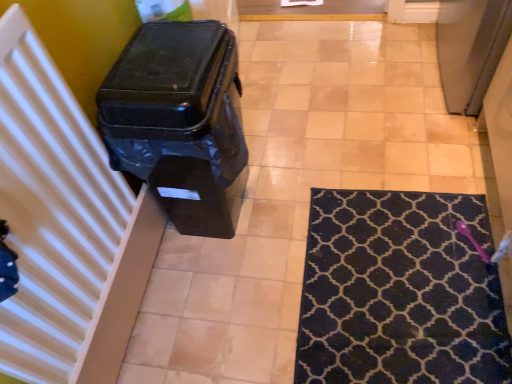
In order to face black plastic waste container at left, should I rotate leftwards or rightwards?

Turn left approximately 7.880 degrees to face it.

The image size is (512, 384). Identify the location of navy blue textured rug at lower right. (400, 292).

Locate an element on the screen. This screenshot has height=384, width=512. white striped radiator at left is located at coordinates (82, 39).

Who is shorter, white striped radiator at left or black plastic waste container at left?

white striped radiator at left.

From the image's perspective, relative to black plastic waste container at left, is white striped radiator at left above or below?

From the image's perspective, white striped radiator at left appears below black plastic waste container at left.

From a real-world perspective, between white striped radiator at left and black plastic waste container at left, who is vertically higher?

white striped radiator at left, from a real-world perspective.

Is white striped radiator at left at the left side of black plastic waste container at left?

Yes.

From a real-world perspective, which object rests below the other?

In real-world perspective, black plastic waste container at left is lower.

Is black plastic waste container at left beside white striped radiator at left?

black plastic waste container at left and white striped radiator at left are clearly separated.

From the image's perspective, would you say black plastic waste container at left is shown under white striped radiator at left?

No, from the image's perspective, black plastic waste container at left is not beneath white striped radiator at left.

Is white striped radiator at left completely or partially inside black plastic waste container at left?

No.

Who is smaller, navy blue textured rug at lower right or white striped radiator at left?

navy blue textured rug at lower right.

Is navy blue textured rug at lower right taller than white striped radiator at left?

Incorrect, the height of navy blue textured rug at lower right is not larger of that of white striped radiator at left.

From a real-world perspective, is navy blue textured rug at lower right below white striped radiator at left?

Yes, from a real-world perspective, navy blue textured rug at lower right is below white striped radiator at left.

Is navy blue textured rug at lower right oriented towards white striped radiator at left?

No, navy blue textured rug at lower right is not turned towards white striped radiator at left.

Consider the image. From a real-world perspective, is navy blue textured rug at lower right physically located above or below black plastic waste container at left?

From a real-world perspective, navy blue textured rug at lower right is physically below black plastic waste container at left.

Image resolution: width=512 pixels, height=384 pixels. Find the location of `waste container in front of the navy blue textured rug at lower right`. waste container in front of the navy blue textured rug at lower right is located at coordinates (179, 121).

From the picture: Which object is further away from the camera taking this photo, navy blue textured rug at lower right or black plastic waste container at left?

navy blue textured rug at lower right is further away from the camera.

Is black plastic waste container at left bigger or smaller than navy blue textured rug at lower right?

black plastic waste container at left is bigger than navy blue textured rug at lower right.

Is navy blue textured rug at lower right at the back of black plastic waste container at left?

That's not correct — black plastic waste container at left is not looking away from navy blue textured rug at lower right.

In the scene shown: Which is closer to the camera, (170,50) or (494,303)?

Point (170,50).

Which object is further away from the camera, black plastic waste container at left or navy blue textured rug at lower right?

navy blue textured rug at lower right is behind.

The image size is (512, 384). Find the location of `radiator above the navy blue textured rug at lower right (from a real-world perspective)`. radiator above the navy blue textured rug at lower right (from a real-world perspective) is located at coordinates (82, 39).

Considering the relative sizes of white striped radiator at left and navy blue textured rug at lower right in the image provided, is white striped radiator at left shorter than navy blue textured rug at lower right?

Incorrect, the height of white striped radiator at left does not fall short of that of navy blue textured rug at lower right.

Considering the positions of objects white striped radiator at left and navy blue textured rug at lower right in the image provided, who is more to the right, white striped radiator at left or navy blue textured rug at lower right?

From the viewer's perspective, navy blue textured rug at lower right appears more on the right side.

The image size is (512, 384). Find the location of `waste container that is above the white striped radiator at left (from the image's perspective)`. waste container that is above the white striped radiator at left (from the image's perspective) is located at coordinates (179, 121).

The height and width of the screenshot is (384, 512). In order to click on waste container below the white striped radiator at left (from a real-world perspective) in this screenshot , I will do [x=179, y=121].

From the image, which object appears to be nearer to navy blue textured rug at lower right, black plastic waste container at left or white striped radiator at left?

The object closer to navy blue textured rug at lower right is black plastic waste container at left.

Which object lies further to the anchor point white striped radiator at left, black plastic waste container at left or navy blue textured rug at lower right?

The object further to white striped radiator at left is navy blue textured rug at lower right.

Based on their spatial positions, is navy blue textured rug at lower right or black plastic waste container at left further from white striped radiator at left?

navy blue textured rug at lower right is positioned further to the anchor white striped radiator at left.

Looking at the image, which one is located closer to navy blue textured rug at lower right, white striped radiator at left or black plastic waste container at left?

black plastic waste container at left.

Considering their positions, is white striped radiator at left positioned further to black plastic waste container at left than navy blue textured rug at lower right?

The object further to black plastic waste container at left is navy blue textured rug at lower right.

From the image, which object appears to be farther from black plastic waste container at left, navy blue textured rug at lower right or white striped radiator at left?

Based on the image, navy blue textured rug at lower right appears to be further to black plastic waste container at left.

The width and height of the screenshot is (512, 384). I want to click on waste container between white striped radiator at left and navy blue textured rug at lower right in the horizontal direction, so click(179, 121).